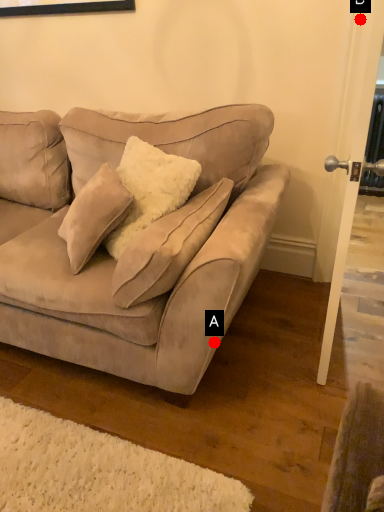
Question: Two points are circled on the image, labeled by A and B beside each circle. Which point is closer to the camera?

Choices:
 (A) A is closer
 (B) B is closer

Answer: (A)